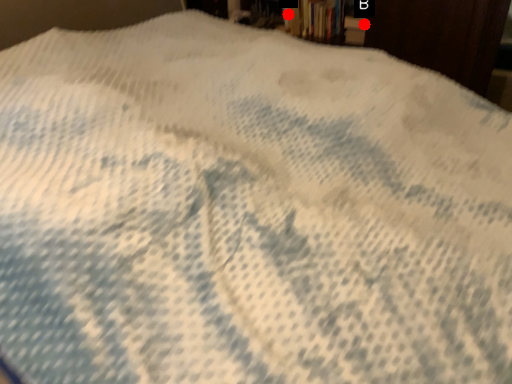
Question: Two points are circled on the image, labeled by A and B beside each circle. Among these points, which one is nearest to the camera?

Choices:
 (A) A is closer
 (B) B is closer

Answer: (B)